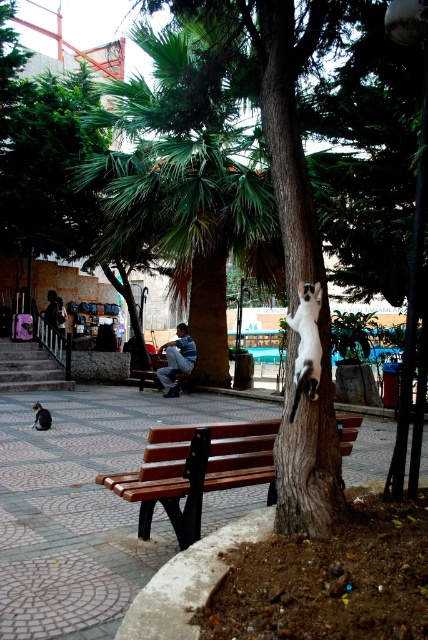
Who is taller, brown wood bench at center or white fur cat at upper center?

With more height is brown wood bench at center.

The width and height of the screenshot is (428, 640). I want to click on brown wood bench at center, so click(x=196, y=470).

Find the location of a particular element. The height and width of the screenshot is (640, 428). brown wood bench at center is located at coordinates (196, 470).

Can you confirm if white fur cat at center is smaller than denim jacket at left?

Yes.

Who is more distant from viewer, (317, 337) or (45, 314)?

Point (45, 314)

Identify the location of white fur cat at center. Image resolution: width=428 pixels, height=640 pixels. (306, 342).

The width and height of the screenshot is (428, 640). I want to click on brown wood bench at center, so click(196, 470).

Is brown wood bench at center taller than denim pants at center?

Indeed, brown wood bench at center has a greater height compared to denim pants at center.

Does point (143, 483) come in front of point (169, 394)?

Yes.

Where is `brown wood bench at center`? The image size is (428, 640). brown wood bench at center is located at coordinates (196, 470).